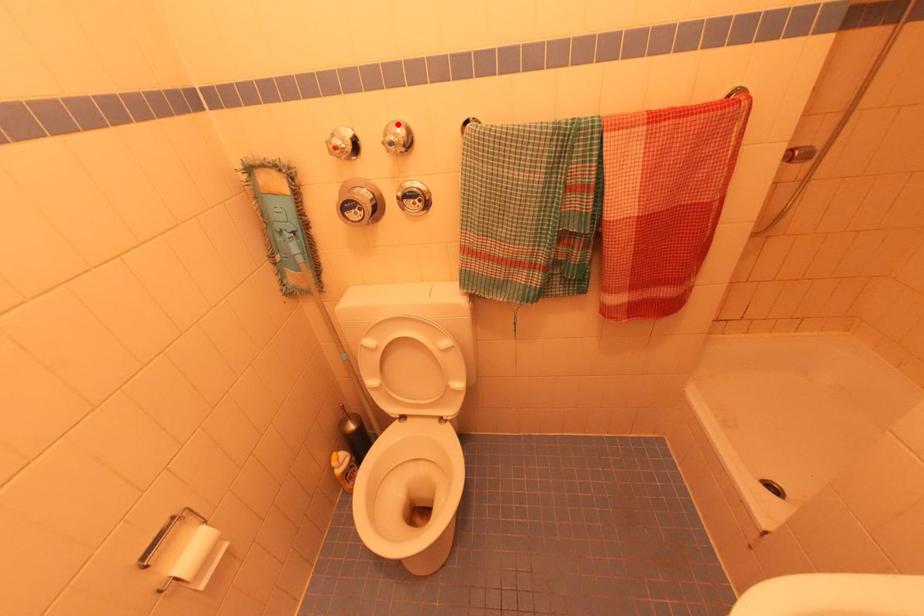
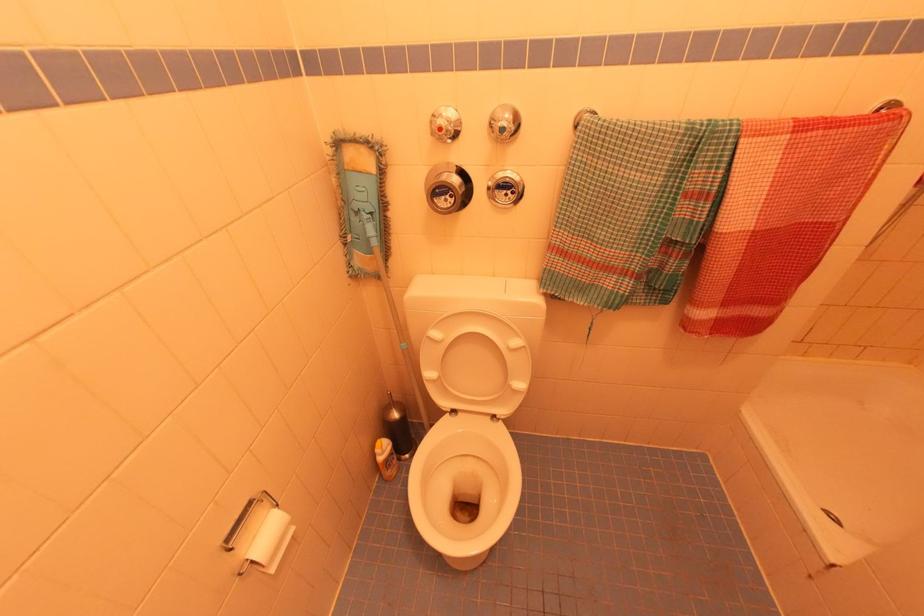
In the second image, find the point that corresponds to the highlighted location in the first image.

(505, 108)